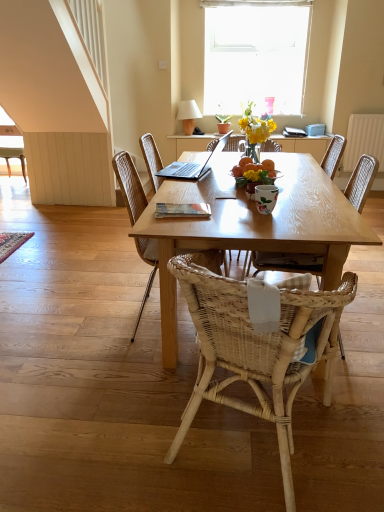
Identify the location of vacant space to the left of woven wood chair at center, positioned as the second chair in back-to-front order. (93, 322).